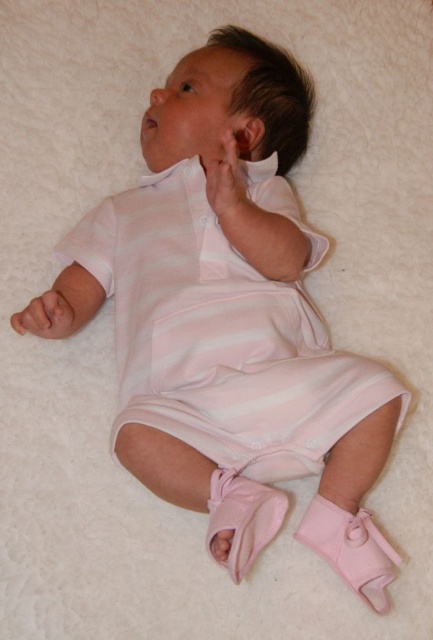
Is pink fabric hand at upper center taller than pink soft fabric hand at upper left?

Indeed, pink fabric hand at upper center has a greater height compared to pink soft fabric hand at upper left.

Between pink fabric hand at upper center and pink soft fabric hand at upper left, which one is positioned lower?

pink soft fabric hand at upper left

In the scene shown: Who is more distant from viewer, (236, 161) or (52, 317)?

Point (52, 317)

Where is `pink fabric hand at upper center`? The image size is (433, 640). pink fabric hand at upper center is located at coordinates (226, 179).